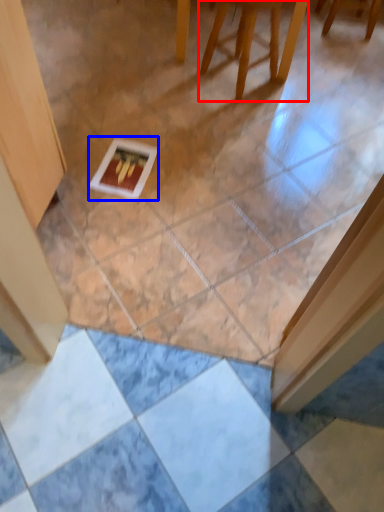
Question: Among these objects, which one is nearest to the camera, furniture (highlighted by a red box) or postcard (highlighted by a blue box)?

Choices:
 (A) furniture
 (B) postcard

Answer: (A)